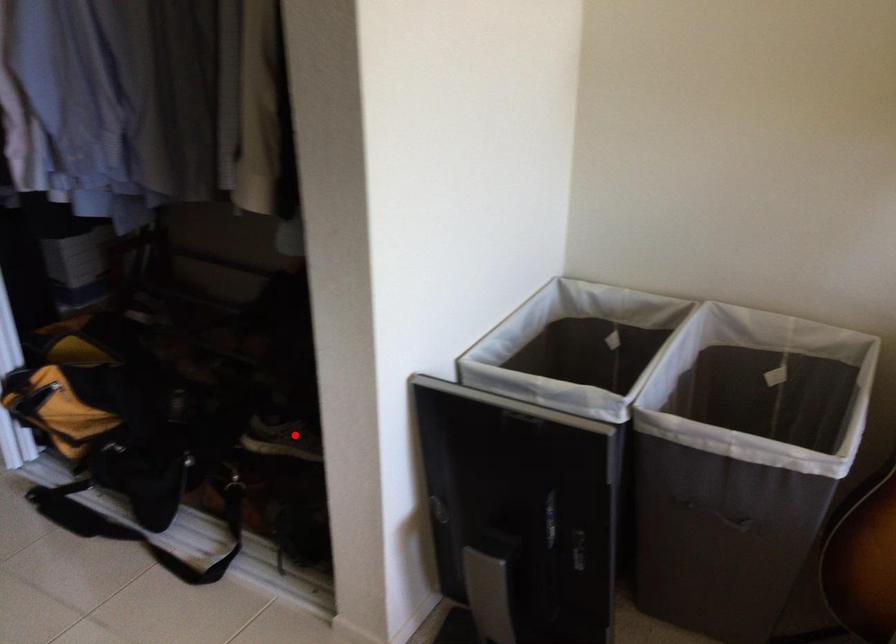
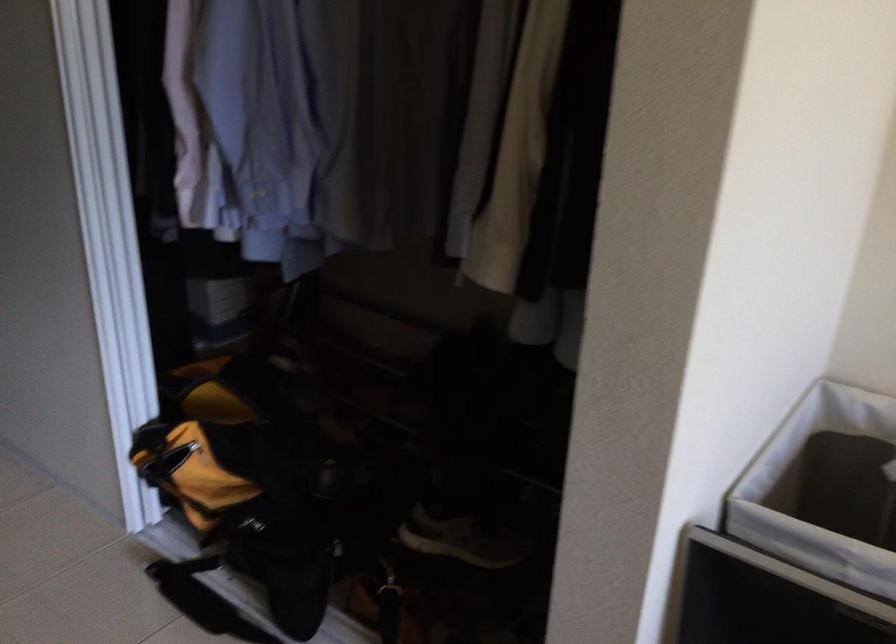
The point at the highlighted location is marked in the first image. Where is the corresponding point in the second image?

(461, 540)